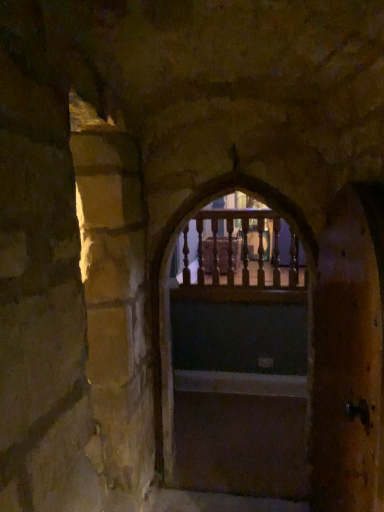
Question: From a real-world perspective, does wooden railing at center stand above wooden railing at center?

Choices:
 (A) no
 (B) yes

Answer: (A)

Question: Considering the relative sizes of wooden railing at center and wooden railing at center in the image provided, is wooden railing at center bigger than wooden railing at center?

Choices:
 (A) no
 (B) yes

Answer: (B)

Question: Considering the relative sizes of wooden railing at center and wooden railing at center in the image provided, is wooden railing at center smaller than wooden railing at center?

Choices:
 (A) yes
 (B) no

Answer: (B)

Question: Considering the relative positions of wooden railing at center and wooden railing at center in the image provided, is wooden railing at center to the left of wooden railing at center from the viewer's perspective?

Choices:
 (A) no
 (B) yes

Answer: (B)

Question: From the image's perspective, is wooden railing at center under wooden railing at center?

Choices:
 (A) yes
 (B) no

Answer: (A)

Question: Considering the positions of point (350, 330) and point (291, 467), is point (350, 330) closer or farther from the camera than point (291, 467)?

Choices:
 (A) farther
 (B) closer

Answer: (B)

Question: From their relative heights in the image, would you say wooden door at right is taller or shorter than smooth wooden stairs at center?

Choices:
 (A) short
 (B) tall

Answer: (B)

Question: Is wooden door at right in front of or behind smooth wooden stairs at center in the image?

Choices:
 (A) front
 (B) behind

Answer: (A)

Question: Do you think wooden door at right is within smooth wooden stairs at center, or outside of it?

Choices:
 (A) inside
 (B) outside

Answer: (B)

Question: In terms of height, does smooth wooden stairs at center look taller or shorter compared to wooden door at right?

Choices:
 (A) tall
 (B) short

Answer: (B)

Question: From a real-world perspective, is smooth wooden stairs at center physically located above or below wooden door at right?

Choices:
 (A) below
 (B) above

Answer: (A)

Question: In the image, is smooth wooden stairs at center on the left side or the right side of wooden door at right?

Choices:
 (A) left
 (B) right

Answer: (A)

Question: Is smooth wooden stairs at center in front of or behind wooden door at right in the image?

Choices:
 (A) front
 (B) behind

Answer: (B)

Question: Is wooden railing at center inside the boundaries of wooden railing at center, or outside?

Choices:
 (A) outside
 (B) inside

Answer: (A)

Question: In the image, is wooden railing at center on the left side or the right side of wooden railing at center?

Choices:
 (A) left
 (B) right

Answer: (A)